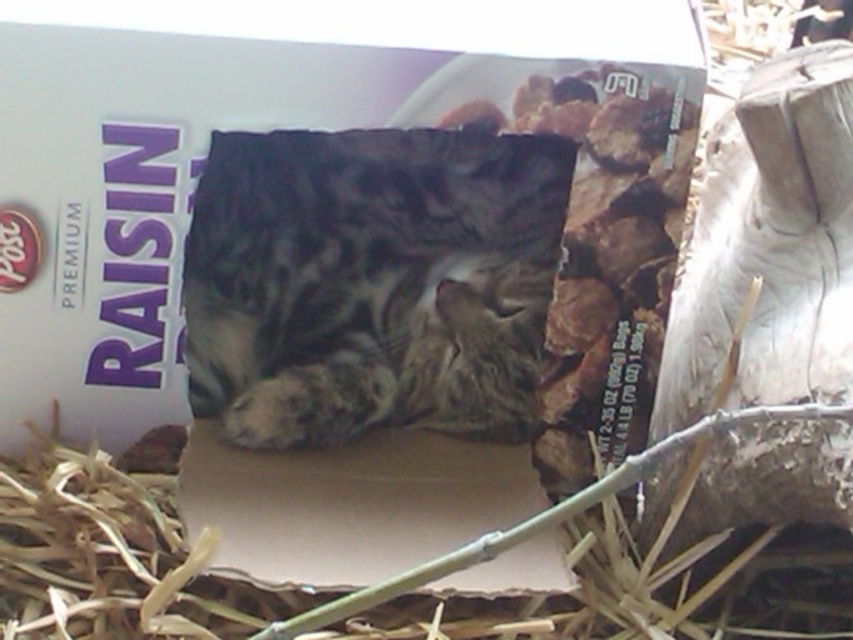
Does gray fur cat at center appear over brown cardboard at center?

Yes, gray fur cat at center is above brown cardboard at center.

Can you confirm if gray fur cat at center is wider than brown cardboard at center?

Indeed, gray fur cat at center has a greater width compared to brown cardboard at center.

Between point (440, 173) and point (187, 445), which one is positioned in front?

Positioned in front is point (187, 445).

At what (x,y) coordinates should I click in order to perform the action: click on gray fur cat at center. Please return your answer as a coordinate pair (x, y). Looking at the image, I should click on (370, 282).

Who is shorter, gray fur cat at center or brown straw at lower center?

brown straw at lower center

Which is in front, point (293, 356) or point (105, 605)?

Point (105, 605) is in front.

Where is `gray fur cat at center`? This screenshot has height=640, width=853. gray fur cat at center is located at coordinates (370, 282).

Image resolution: width=853 pixels, height=640 pixels. What do you see at coordinates (347, 504) in the screenshot?
I see `brown cardboard at center` at bounding box center [347, 504].

Which is in front, point (199, 513) or point (194, 627)?

Point (194, 627) is more forward.

Identify the location of brown cardboard at center. (347, 504).